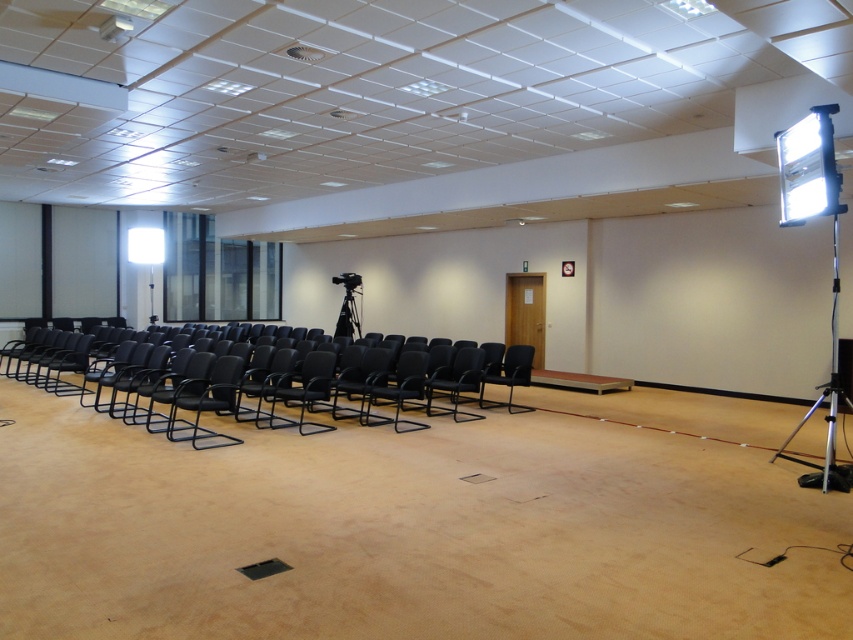
What do you see at coordinates (808, 168) in the screenshot?
I see `white glossy projector at upper right` at bounding box center [808, 168].

Which of these two, white glossy projector at upper right or white plastic projector at upper left, stands taller?

white glossy projector at upper right

Locate an element on the screen. white glossy projector at upper right is located at coordinates (808, 168).

Can you confirm if black leather chair at center is positioned to the left of white plastic projector at upper left?

No, black leather chair at center is not to the left of white plastic projector at upper left.

Who is taller, black leather chair at center or white plastic projector at upper left?

black leather chair at center

The height and width of the screenshot is (640, 853). Find the location of `black leather chair at center`. black leather chair at center is located at coordinates (508, 376).

In the scene shown: Does silver metallic tripod at right have a lesser height compared to black leather chair at center?

Yes.

Based on the photo, who is more forward, (782, 449) or (509, 387)?

Point (782, 449) is more forward.

Which is behind, point (828, 440) or point (529, 353)?

The point (529, 353) is behind.

Image resolution: width=853 pixels, height=640 pixels. In order to click on silver metallic tripod at right in this screenshot , I will do `click(828, 404)`.